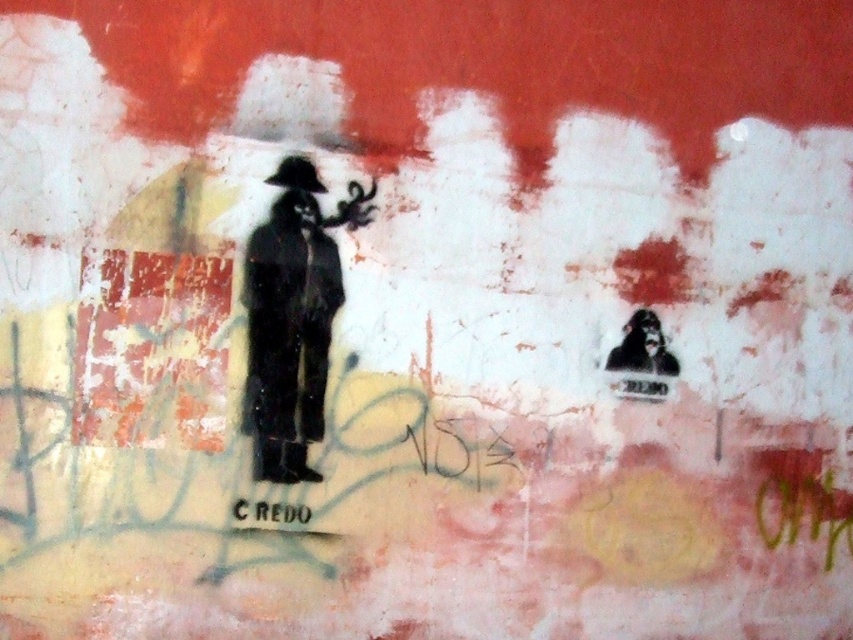
Between point (253, 236) and point (622, 362), which one is positioned in front?

Positioned in front is point (253, 236).

This screenshot has height=640, width=853. Describe the element at coordinates (292, 317) in the screenshot. I see `black matte figure at center` at that location.

Image resolution: width=853 pixels, height=640 pixels. I want to click on black matte figure at center, so (x=292, y=317).